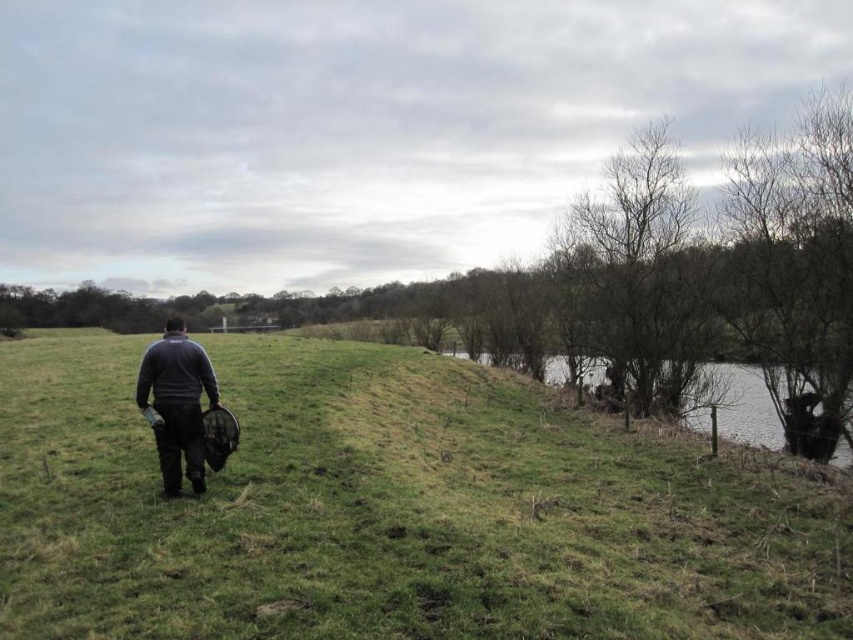
You are a hiker trying to cross from the green grassy hill at center to the green grassy bank at right. Which path would require walking a shorter distance? Please consider the spatial relationship between the two areas.

The green grassy bank at right is narrower than the green grassy hill at center, so the path to the green grassy bank at right would require walking a shorter distance.

You are standing at the point labeled point (380, 440) and want to walk to the point labeled point (708, 368). Given that the path between them is straight, how many steps would you need to take if each step covers 0.1 units of distance?

The distance between point (380, 440) and point (708, 368) can be calculated using the distance formula. The difference in the x coordinates is 0.575 minus 0.689 equals negative 0.114. The difference in the y coordinates is 0.831 minus 0.447 equals 0.384. Squaring these differences gives 0.013 and 0.147, respectively. Adding them together gives 0.160. Taking the square root of 0.160 gives approximately 0.4 units. Since each step covers 0.1 units, dividing 0.4 by 0.1 gives 4 steps. Therefore, you would n

You are a hiker who needs to cross the river. You see the bare branches at upper right and the green grassy bank at right. How far apart are these two landmarks?

The bare branches at upper right is 2.93 meters from the green grassy bank at right, so the distance between them is 2.93 meters.